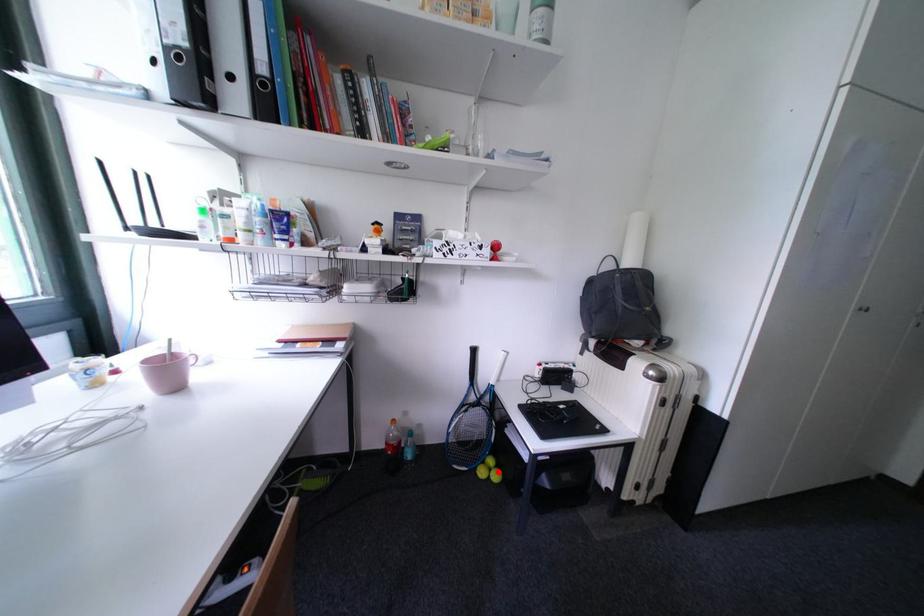
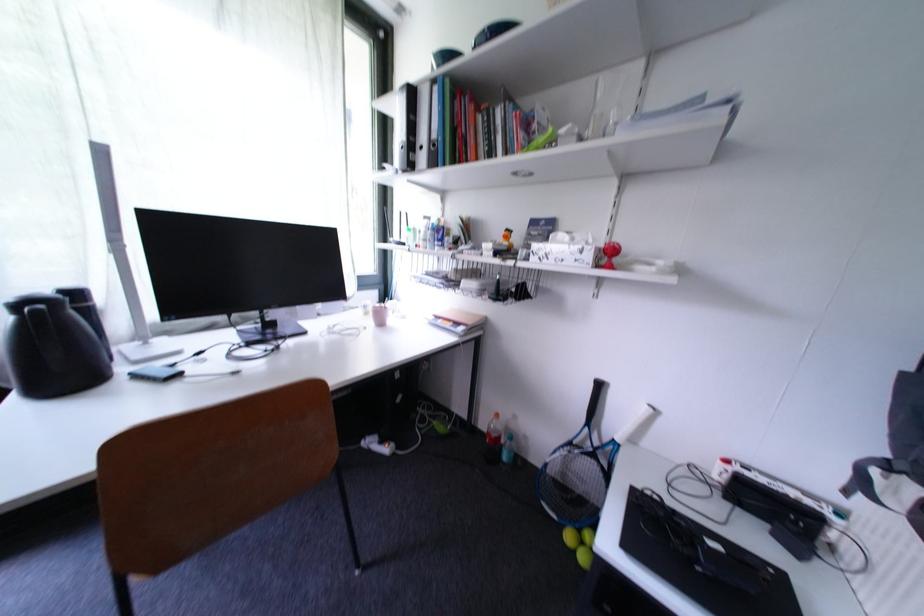
Where in the second image is the point corresponding to the highlighted location from the first image?

(590, 546)